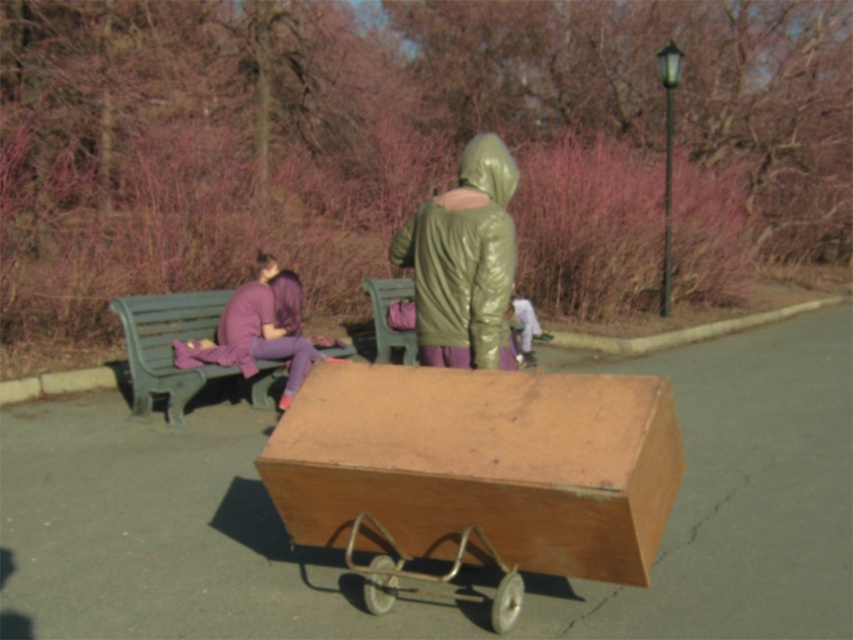
Question: Among these points, which one is farthest from the camera?

Choices:
 (A) (268, 376)
 (B) (505, 173)

Answer: (A)

Question: Which of the following is the farthest from the observer?

Choices:
 (A) (505, 195)
 (B) (263, 397)

Answer: (B)

Question: Does green shiny jacket at center have a lesser width compared to green plastic bench at left?

Choices:
 (A) no
 (B) yes

Answer: (B)

Question: Can you confirm if green shiny jacket at center is positioned to the right of green plastic bench at left?

Choices:
 (A) no
 (B) yes

Answer: (B)

Question: Among these points, which one is nearest to the camera?

Choices:
 (A) (482, 148)
 (B) (143, 324)

Answer: (A)

Question: Can you confirm if green shiny jacket at center is positioned to the left of green plastic bench at left?

Choices:
 (A) no
 (B) yes

Answer: (A)